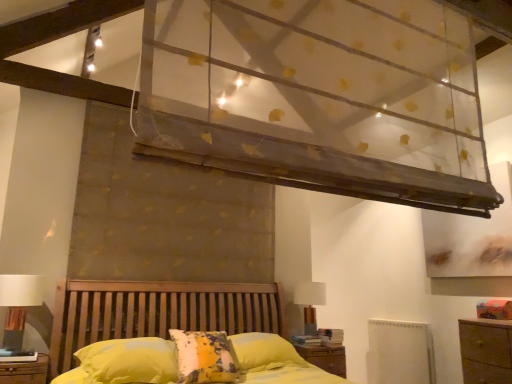
The height and width of the screenshot is (384, 512). What do you see at coordinates (129, 361) in the screenshot?
I see `yellow fabric pillow at center` at bounding box center [129, 361].

How much space does white fabric lampshade at left, which is the first table lamp from left to right, occupy horizontally?

The width of white fabric lampshade at left, which is the first table lamp from left to right, is 12.40 inches.

Find the location of `transparent fabric canopy at upper center`. transparent fabric canopy at upper center is located at coordinates (296, 92).

Image resolution: width=512 pixels, height=384 pixels. Identify the location of white fabric lampshade at upper right, marked as the 1th table lamp in a right-to-left arrangement. (310, 303).

Consider the image. Could you tell me if white fabric lampshade at upper right, marked as the second table lamp in a left-to-right arrangement, is facing white fabric lampshade at left, acting as the 2th table lamp starting from the right?

No, white fabric lampshade at upper right, marked as the second table lamp in a left-to-right arrangement, is not oriented towards white fabric lampshade at left, acting as the 2th table lamp starting from the right.

From the image's perspective, which is below, white fabric lampshade at upper right, positioned as the first table lamp in back-to-front order, or white fabric lampshade at left, the 2th table lamp viewed from the back?

From the image's view, white fabric lampshade at upper right, positioned as the first table lamp in back-to-front order, is below.

Does white fabric lampshade at upper right, marked as the second table lamp in a left-to-right arrangement, have a greater height compared to white fabric lampshade at left, which is the first table lamp from left to right?

No, white fabric lampshade at upper right, marked as the second table lamp in a left-to-right arrangement, is not taller than white fabric lampshade at left, which is the first table lamp from left to right.

From a real-world perspective, who is located lower, white fabric lampshade at upper right, the 2th table lamp from the front, or white fabric lampshade at left, the 1th table lamp from the front?

From a 3D spatial view, white fabric lampshade at upper right, the 2th table lamp from the front, is below.

From the image's perspective, is transparent fabric canopy at upper center located above white fabric lampshade at upper right, marked as the second table lamp in a left-to-right arrangement?

Yes, from the image's perspective, transparent fabric canopy at upper center is over white fabric lampshade at upper right, marked as the second table lamp in a left-to-right arrangement.

Is transparent fabric canopy at upper center bigger than white fabric lampshade at upper right, marked as the second table lamp in a left-to-right arrangement?

Indeed, transparent fabric canopy at upper center has a larger size compared to white fabric lampshade at upper right, marked as the second table lamp in a left-to-right arrangement.

Considering the sizes of objects transparent fabric canopy at upper center and white fabric lampshade at upper right, the 2th table lamp from the front, in the image provided, who is taller, transparent fabric canopy at upper center or white fabric lampshade at upper right, the 2th table lamp from the front,?

transparent fabric canopy at upper center.

Which is more to the right, transparent fabric canopy at upper center or white fabric lampshade at upper right, marked as the second table lamp in a left-to-right arrangement?

Positioned to the right is white fabric lampshade at upper right, marked as the second table lamp in a left-to-right arrangement.

Is point (332, 365) closer to camera compared to point (162, 341)?

No, (332, 365) is further to viewer.

Would you say wooden nightstand at lower center contains yellow fabric pillow at center?

Definitely not — yellow fabric pillow at center is not inside wooden nightstand at lower center.

Is wooden nightstand at lower center shorter than yellow fabric pillow at center?

Indeed, wooden nightstand at lower center has a lesser height compared to yellow fabric pillow at center.

Does wooden nightstand at lower center appear on the right side of yellow fabric pillow at center?

Correct, you'll find wooden nightstand at lower center to the right of yellow fabric pillow at center.

Which is behind, point (382, 322) or point (342, 365)?

Point (382, 322)

Looking at their sizes, would you say white matte radiator at lower right is wider or thinner than wooden nightstand at lower center?

Considering their sizes, white matte radiator at lower right looks slimmer than wooden nightstand at lower center.

Is white matte radiator at lower right turned away from wooden nightstand at lower center?

No, wooden nightstand at lower center is not at the back of white matte radiator at lower right.

Considering the sizes of white matte radiator at lower right and wooden nightstand at lower center in the image, is white matte radiator at lower right taller or shorter than wooden nightstand at lower center?

Considering their sizes, white matte radiator at lower right has more height than wooden nightstand at lower center.

Looking at their sizes, would you say white fabric lampshade at left, the 1th table lamp from the front, is wider or thinner than wooden nightstand at lower center?

In the image, white fabric lampshade at left, the 1th table lamp from the front, appears to be more narrow than wooden nightstand at lower center.

Does white fabric lampshade at left, the 1th table lamp from the front, appear on the right side of wooden nightstand at lower center?

In fact, white fabric lampshade at left, the 1th table lamp from the front, is to the left of wooden nightstand at lower center.

Which object is closer to the camera, white fabric lampshade at left, the 2th table lamp viewed from the back, or wooden nightstand at lower center?

white fabric lampshade at left, the 2th table lamp viewed from the back, is in front.

From the image's perspective, between white fabric lampshade at left, acting as the 2th table lamp starting from the right, and wooden nightstand at lower center, which one is located above?

white fabric lampshade at left, acting as the 2th table lamp starting from the right, from the image's perspective.

Considering the sizes of objects wooden nightstand at lower center and white fabric lampshade at upper right, marked as the second table lamp in a left-to-right arrangement, in the image provided, who is wider, wooden nightstand at lower center or white fabric lampshade at upper right, marked as the second table lamp in a left-to-right arrangement,?

Wider between the two is wooden nightstand at lower center.

Looking at this image, considering the sizes of wooden nightstand at lower center and white fabric lampshade at upper right, positioned as the first table lamp in back-to-front order, in the image, is wooden nightstand at lower center bigger or smaller than white fabric lampshade at upper right, positioned as the first table lamp in back-to-front order,?

In the image, wooden nightstand at lower center appears to be larger than white fabric lampshade at upper right, positioned as the first table lamp in back-to-front order.

Where is `nightstand beneath the white fabric lampshade at upper right, marked as the 1th table lamp in a right-to-left arrangement (from a real-world perspective)`? nightstand beneath the white fabric lampshade at upper right, marked as the 1th table lamp in a right-to-left arrangement (from a real-world perspective) is located at coordinates (325, 358).

Is point (343, 347) farther from camera compared to point (313, 331)?

No, (343, 347) is in front of (313, 331).

In the image, is white fabric lampshade at left, acting as the 2th table lamp starting from the right, on the left side or the right side of yellow fabric pillow at center?

From the image, it's evident that white fabric lampshade at left, acting as the 2th table lamp starting from the right, is to the left of yellow fabric pillow at center.

Does white fabric lampshade at left, which is the first table lamp from left to right, have a greater width compared to yellow fabric pillow at center?

In fact, white fabric lampshade at left, which is the first table lamp from left to right, might be narrower than yellow fabric pillow at center.

How many degrees apart are the facing directions of white fabric lampshade at left, which is the first table lamp from left to right, and yellow fabric pillow at center?

0.634 degrees separate the facing orientations of white fabric lampshade at left, which is the first table lamp from left to right, and yellow fabric pillow at center.

How far apart are white fabric lampshade at left, acting as the 2th table lamp starting from the right, and yellow fabric pillow at center?

white fabric lampshade at left, acting as the 2th table lamp starting from the right, is 28.50 inches away from yellow fabric pillow at center.

What are the coordinates of `table lamp that is on the left side of white fabric lampshade at upper right, marked as the second table lamp in a left-to-right arrangement` in the screenshot? It's located at (18, 305).

The width and height of the screenshot is (512, 384). I want to click on canopy bed in front of the white fabric lampshade at upper right, marked as the second table lamp in a left-to-right arrangement, so click(x=296, y=92).

From the picture: From the image, which object appears to be nearer to transparent fabric canopy at upper center, white fabric lampshade at left, acting as the 2th table lamp starting from the right, or white matte radiator at lower right?

white fabric lampshade at left, acting as the 2th table lamp starting from the right, lies closer to transparent fabric canopy at upper center than the other object.

Which object lies nearer to the anchor point transparent fabric canopy at upper center, white fabric lampshade at upper right, marked as the second table lamp in a left-to-right arrangement, or white fabric lampshade at left, the 2th table lamp viewed from the back?

Among the two, white fabric lampshade at upper right, marked as the second table lamp in a left-to-right arrangement, is located nearer to transparent fabric canopy at upper center.

Considering their positions, is transparent fabric canopy at upper center positioned further to white matte radiator at lower right than yellow fabric pillow at center?

Among the two, transparent fabric canopy at upper center is located further to white matte radiator at lower right.

Considering their positions, is yellow fabric pillow at center positioned closer to white matte radiator at lower right than wooden nightstand at lower center?

wooden nightstand at lower center.

From the picture: Estimate the real-world distances between objects in this image. Which object is further from transparent fabric canopy at upper center, yellow fabric pillow at center or wooden nightstand at lower center?

wooden nightstand at lower center is further to transparent fabric canopy at upper center.

Considering their positions, is white matte radiator at lower right positioned closer to white fabric lampshade at left, the 2th table lamp viewed from the back, than wooden nightstand at lower center?

wooden nightstand at lower center.

From the image, which object appears to be farther from wooden nightstand at lower center, white matte radiator at lower right or white fabric lampshade at left, which is the first table lamp from left to right?

The object further to wooden nightstand at lower center is white fabric lampshade at left, which is the first table lamp from left to right.

From the image, which object appears to be farther from white matte radiator at lower right, white fabric lampshade at upper right, marked as the second table lamp in a left-to-right arrangement, or white fabric lampshade at left, acting as the 2th table lamp starting from the right?

white fabric lampshade at left, acting as the 2th table lamp starting from the right.

You are a GUI agent. You are given a task and a screenshot of the screen. Output one action in this format:
    pyautogui.click(x=<x>, y=<y>)
    Task: Click on the pillow between white fabric lampshade at left, which is the first table lamp from left to right, and wooden nightstand at lower center
    The height and width of the screenshot is (384, 512).
    Given the screenshot: What is the action you would take?
    pyautogui.click(x=129, y=361)

This screenshot has height=384, width=512. Identify the location of nightstand between white fabric lampshade at left, the 2th table lamp viewed from the back, and white matte radiator at lower right from left to right. (325, 358).

Locate an element on the screen. pillow between white fabric lampshade at left, which is the first table lamp from left to right, and white fabric lampshade at upper right, marked as the second table lamp in a left-to-right arrangement is located at coordinates 129,361.

You are a GUI agent. You are given a task and a screenshot of the screen. Output one action in this format:
    pyautogui.click(x=<x>, y=<y>)
    Task: Click on the pillow between transparent fabric canopy at upper center and white fabric lampshade at upper right, positioned as the first table lamp in back-to-front order, along the z-axis
    The height and width of the screenshot is (384, 512).
    Given the screenshot: What is the action you would take?
    pyautogui.click(x=129, y=361)